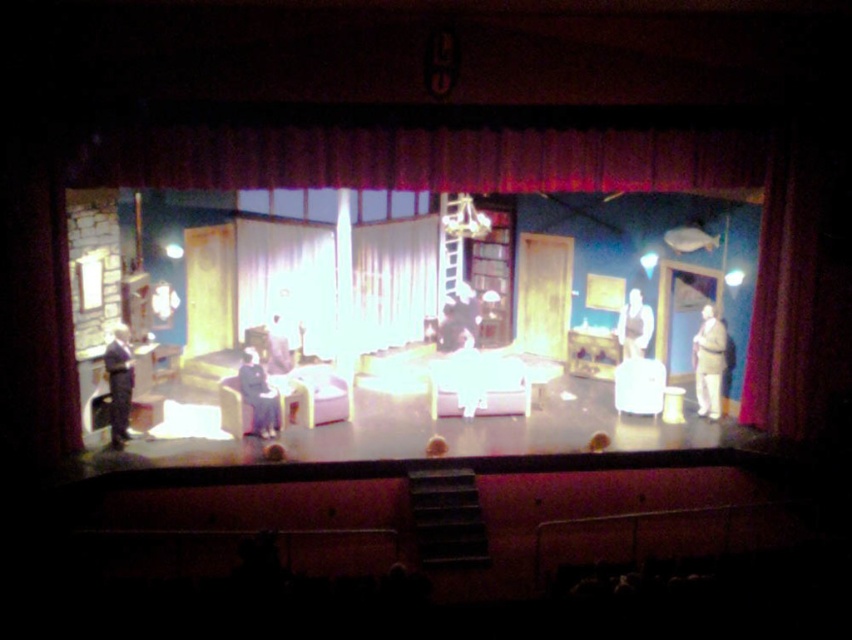
Question: Can you confirm if velvet dark red curtain at upper center is positioned below white fabric curtain at center?

Choices:
 (A) no
 (B) yes

Answer: (A)

Question: Estimate the real-world distances between objects in this image. Which object is farther from the dark blue suit at left?

Choices:
 (A) velvet red curtain at right
 (B) white matte dress at center
 (C) smooth black suit at left
 (D) white cotton shirt at right

Answer: (A)

Question: Is velvet red curtain at right smaller than white matte dress at center?

Choices:
 (A) yes
 (B) no

Answer: (B)

Question: Which is farther from the white fabric curtain at center?

Choices:
 (A) white cotton shirt at right
 (B) velvet red curtain at right
 (C) dark blue suit at left

Answer: (B)

Question: Which object appears closest to the camera in this image?

Choices:
 (A) velvet red curtain at right
 (B) white fabric curtain at center

Answer: (A)

Question: Is white fabric curtain at center to the left of white cotton shirt at right from the viewer's perspective?

Choices:
 (A) yes
 (B) no

Answer: (A)